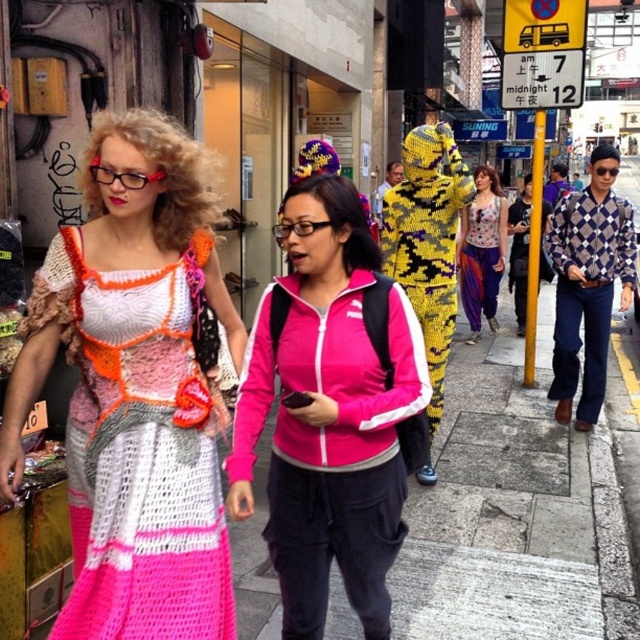
You are a pedestrian standing at the edge of the street. You see the gray concrete pavement at center and the printed fabric dress at center. Which object is closer to you?

The gray concrete pavement at center is closer to you because it is in front of the printed fabric dress at center.

You are standing at the point with coordinates point (465, 228) and want to walk towards the point with coordinates point (216, 483). Which direction should you move in?

You should move forward because point (216, 483) is in front of point (465, 228).

You are a fashion designer observing the two individuals in the scene. You need to create a matching outfit using both the pink fabric jacket at center and the pink fabric dress at center. Considering their positions in the image, which item is closer to you?

The pink fabric jacket at center is closer to you than the pink fabric dress at center since it is only 15.53 feet away from the dress, but the exact distance from the observer isn